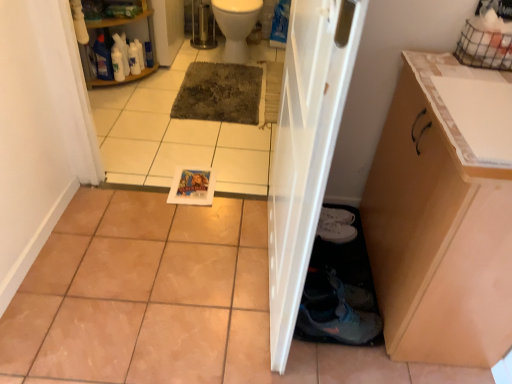
Find the location of a particular element. vacant space underneath white tile at lower center (from a real-world perspective) is located at coordinates (172, 188).